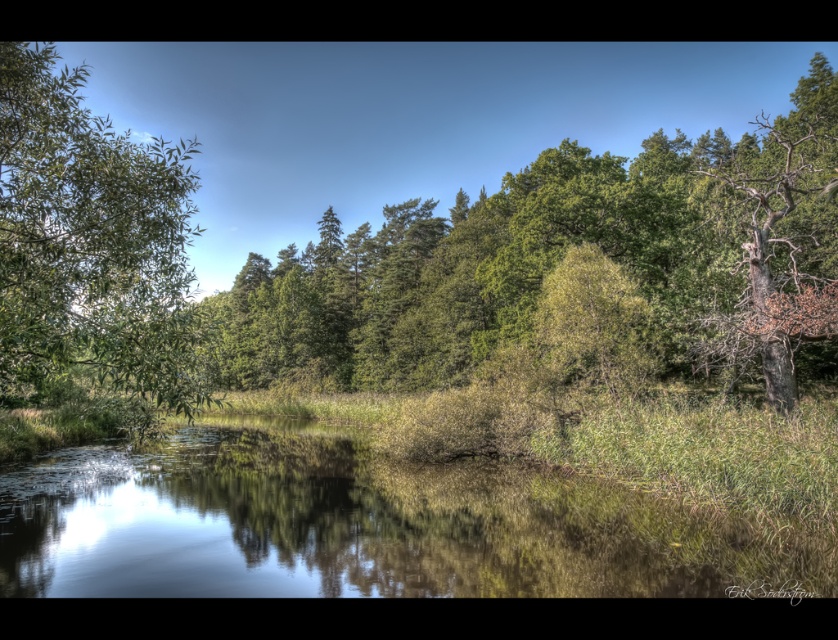
Measure the distance between green leafy tree at center and camera.

green leafy tree at center and camera are 6.23 meters apart.

Who is higher up, green leafy tree at center or green leafy tree at left?

green leafy tree at center

This screenshot has height=640, width=838. Describe the element at coordinates (541, 253) in the screenshot. I see `green leafy tree at center` at that location.

Find the location of a particular element. green leafy tree at center is located at coordinates (541, 253).

Is green grassy lake at center behind green leafy tree at left?

Yes, green grassy lake at center is behind green leafy tree at left.

Is the position of green grassy lake at center less distant than that of green leafy tree at left?

That is False.

This screenshot has height=640, width=838. What do you see at coordinates (355, 525) in the screenshot?
I see `green grassy lake at center` at bounding box center [355, 525].

Where is `green grassy lake at center`? This screenshot has width=838, height=640. green grassy lake at center is located at coordinates (355, 525).

Is green grassy lake at center to the left of green leafy tree at center from the viewer's perspective?

Correct, you'll find green grassy lake at center to the left of green leafy tree at center.

Is point (40, 460) positioned behind point (701, 285)?

No, it is in front of (701, 285).

You are a GUI agent. You are given a task and a screenshot of the screen. Output one action in this format:
    pyautogui.click(x=<x>, y=<y>)
    Task: Click on the green grassy lake at center
    Image resolution: width=838 pixels, height=640 pixels.
    Given the screenshot: What is the action you would take?
    pyautogui.click(x=355, y=525)